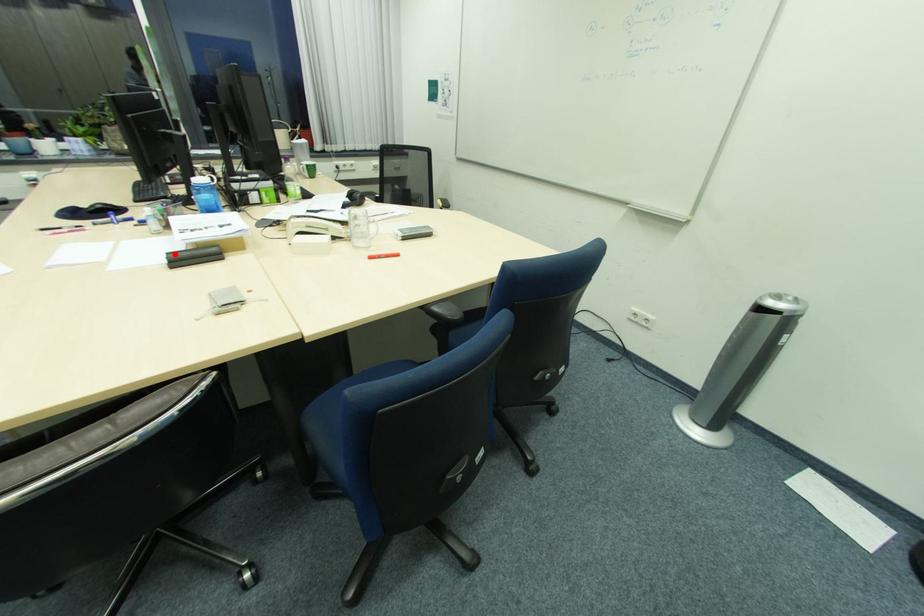
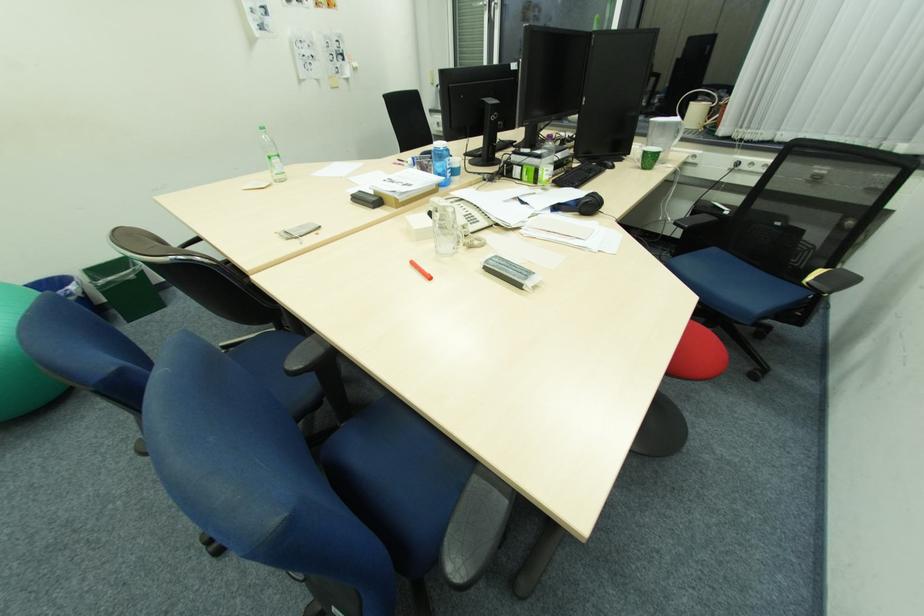
Locate, in the second image, the point that corresponds to the highlighted location in the first image.

(366, 192)